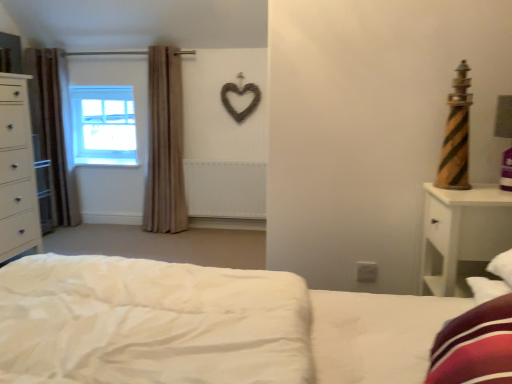
Question: Is point (443, 205) closer or farther from the camera than point (39, 129)?

Choices:
 (A) closer
 (B) farther

Answer: (A)

Question: From a real-world perspective, relative to brown fabric curtain at left, which appears as the second curtain when viewed from the right, is white wood nightstand at right vertically above or below?

Choices:
 (A) above
 (B) below

Answer: (B)

Question: Which object is positioned farthest from the brown fabric curtain at left, acting as the 1th curtain starting from the left?

Choices:
 (A) white matte radiator at center
 (B) white wood nightstand at right
 (C) white glossy chest of drawers at left
 (D) clear glass window at upper left
 (E) beige fabric curtain at left, the second curtain positioned from the left

Answer: (B)

Question: Which object is positioned farthest from the white glossy chest of drawers at left?

Choices:
 (A) beige fabric curtain at left, the second curtain positioned from the left
 (B) brown fabric curtain at left, which appears as the second curtain when viewed from the right
 (C) white wood nightstand at right
 (D) white matte radiator at center
 (E) clear glass window at upper left

Answer: (C)